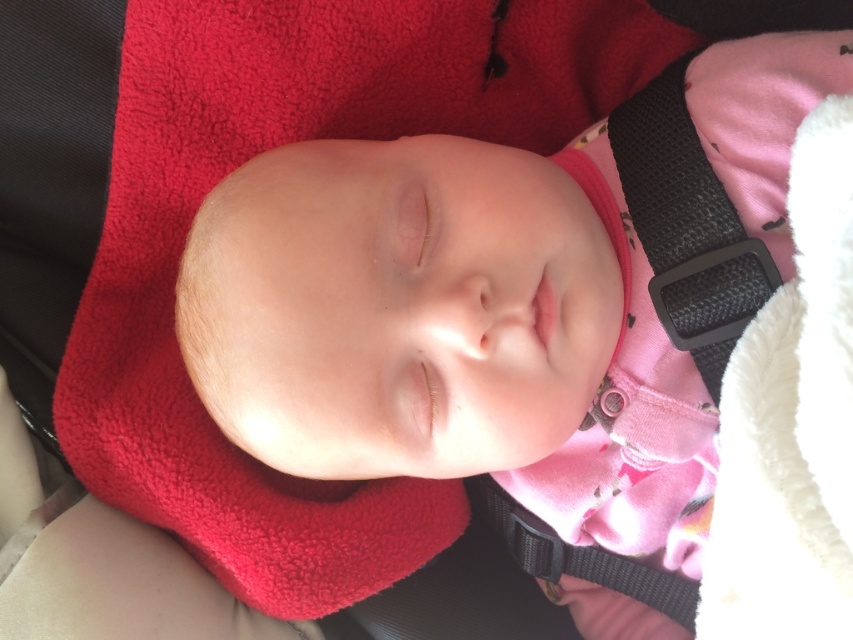
You are a parent checking the car seat straps for your baby. You notice two straps on the car seat cover. The first is the black textured strap at upper right, and the second is the black fabric strap at lower center. Which strap is bigger in size?

The black textured strap at upper right has a larger size compared to the black fabric strap at lower center, so the black textured strap at upper right is bigger in size.

You are a photographer adjusting your camera to focus on two points in the image of a sleeping baby. The first point is at coordinates point (x=660, y=225) and the second is at point (x=601, y=552). Which point should you focus on first if you want to capture the closest object to the camera?

Point (x=660, y=225) is closer to the viewer than point (x=601, y=552), so you should focus on point (x=660, y=225) first to capture the closest object.

You are a parent checking the car seat straps for your baby. You notice two straps on the car seat cover. The first is the black textured strap at upper right, and the second is the black fabric strap at lower center. Which strap is narrower?

The black textured strap at upper right is narrower than the black fabric strap at lower center.